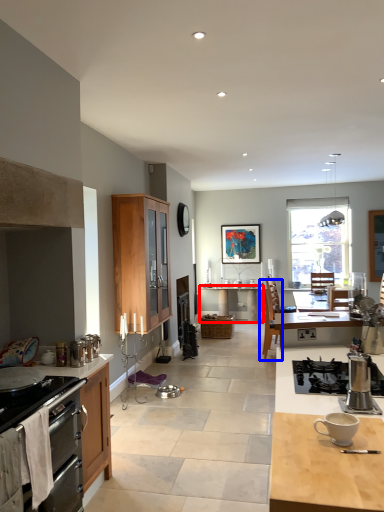
Question: Among these objects, which one is nearest to the camera, desk (highlighted by a red box) or chair (highlighted by a blue box)?

Choices:
 (A) desk
 (B) chair

Answer: (B)